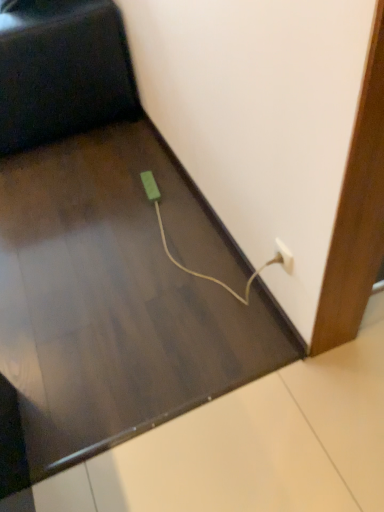
Question: Can you confirm if white plastic plug at lower right is bigger than green matte plug at lower center?

Choices:
 (A) yes
 (B) no

Answer: (B)

Question: From the image's perspective, is white plastic plug at lower right below green matte plug at lower center?

Choices:
 (A) no
 (B) yes

Answer: (B)

Question: Considering the relative positions of white plastic plug at lower right and green matte plug at lower center in the image provided, is white plastic plug at lower right to the right of green matte plug at lower center from the viewer's perspective?

Choices:
 (A) yes
 (B) no

Answer: (A)

Question: Is white plastic plug at lower right beside green matte plug at lower center?

Choices:
 (A) no
 (B) yes

Answer: (A)

Question: Could you tell me if white plastic plug at lower right is facing green matte plug at lower center?

Choices:
 (A) yes
 (B) no

Answer: (B)

Question: From a real-world perspective, is white plastic plug at lower right on green matte plug at lower center?

Choices:
 (A) yes
 (B) no

Answer: (A)

Question: From a real-world perspective, does black matte chair at upper left stand above green matte plug at lower center?

Choices:
 (A) no
 (B) yes

Answer: (B)

Question: Does black matte chair at upper left have a smaller size compared to green matte plug at lower center?

Choices:
 (A) no
 (B) yes

Answer: (A)

Question: Is black matte chair at upper left oriented towards green matte plug at lower center?

Choices:
 (A) yes
 (B) no

Answer: (B)

Question: Is black matte chair at upper left at the right side of green matte plug at lower center?

Choices:
 (A) yes
 (B) no

Answer: (B)

Question: Does black matte chair at upper left contain green matte plug at lower center?

Choices:
 (A) yes
 (B) no

Answer: (B)

Question: Is black matte chair at upper left not inside green matte plug at lower center?

Choices:
 (A) no
 (B) yes

Answer: (B)

Question: Can you confirm if green matte plug at lower center is bigger than black matte chair at upper left?

Choices:
 (A) yes
 (B) no

Answer: (B)